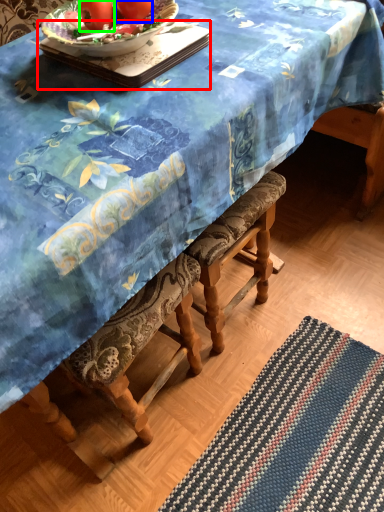
Question: Which object is positioned closest to tray (highlighted by a red box)? Select from tomato (highlighted by a blue box) and tomato (highlighted by a green box).

Choices:
 (A) tomato
 (B) tomato

Answer: (A)